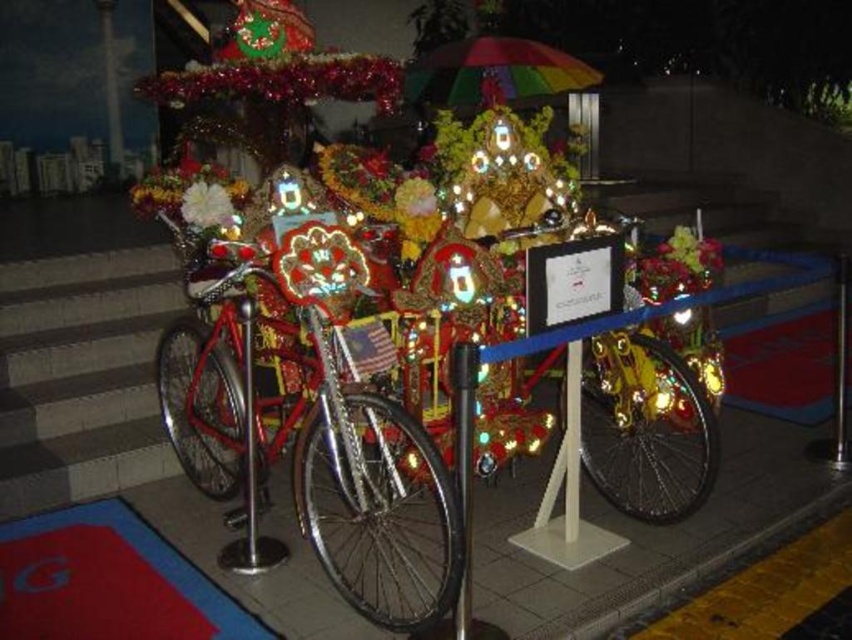
Question: Based on their relative distances, which object is nearer to the shiny metallic bicycle at center?

Choices:
 (A) metallic silver pole at center
 (B) white plastic pole at center

Answer: (A)

Question: Is shiny metallic bicycle at center wider than metallic pole at center?

Choices:
 (A) yes
 (B) no

Answer: (A)

Question: Which point is farther from the camera taking this photo?

Choices:
 (A) (485, 76)
 (B) (839, 284)

Answer: (A)

Question: Is shiny metallic bicycle at center behind metallic silver pole at center?

Choices:
 (A) no
 (B) yes

Answer: (A)

Question: Among these objects, which one is nearest to the camera?

Choices:
 (A) shiny gold bicycle at center
 (B) metallic silver pole at center
 (C) rainbow fabric umbrella at upper center

Answer: (B)

Question: Is shiny gold bicycle at center below metallic silver pole at center?

Choices:
 (A) no
 (B) yes

Answer: (A)